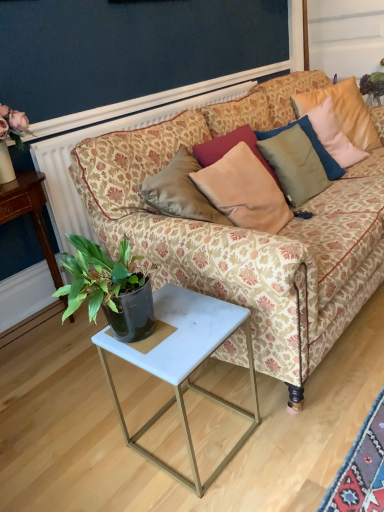
Identify the location of free space in front of white marble table at lower left. The height and width of the screenshot is (512, 384). (48, 381).